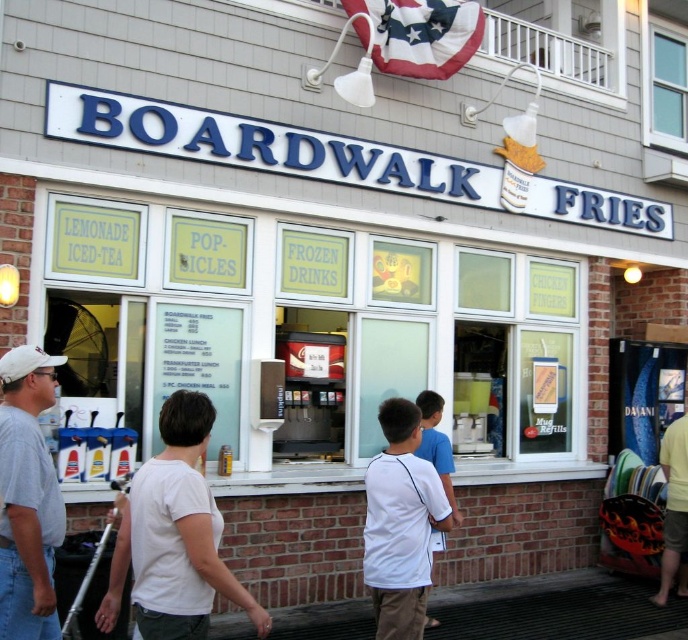
Question: Can you confirm if gray cotton t-shirt at left is positioned to the left of yellow cotton shirt at lower right?

Choices:
 (A) no
 (B) yes

Answer: (B)

Question: Which is nearer to the yellow cotton shirt at lower right?

Choices:
 (A) white matte shirt at center
 (B) white cotton shirt at center
 (C) white matte t-shirt at center

Answer: (B)

Question: Which object is positioned closest to the white cotton shirt at center?

Choices:
 (A) white matte t-shirt at center
 (B) yellow cotton shirt at lower right
 (C) gray cotton t-shirt at left
 (D) white matte shirt at center

Answer: (D)

Question: In this image, where is gray cotton t-shirt at left located relative to white matte shirt at center?

Choices:
 (A) left
 (B) right

Answer: (A)

Question: Which point is closer to the camera?

Choices:
 (A) white matte t-shirt at center
 (B) yellow cotton shirt at lower right
 (C) gray cotton t-shirt at left
 (D) white matte shirt at center

Answer: (A)

Question: Is gray cotton t-shirt at left further to the viewer compared to white matte shirt at center?

Choices:
 (A) no
 (B) yes

Answer: (A)